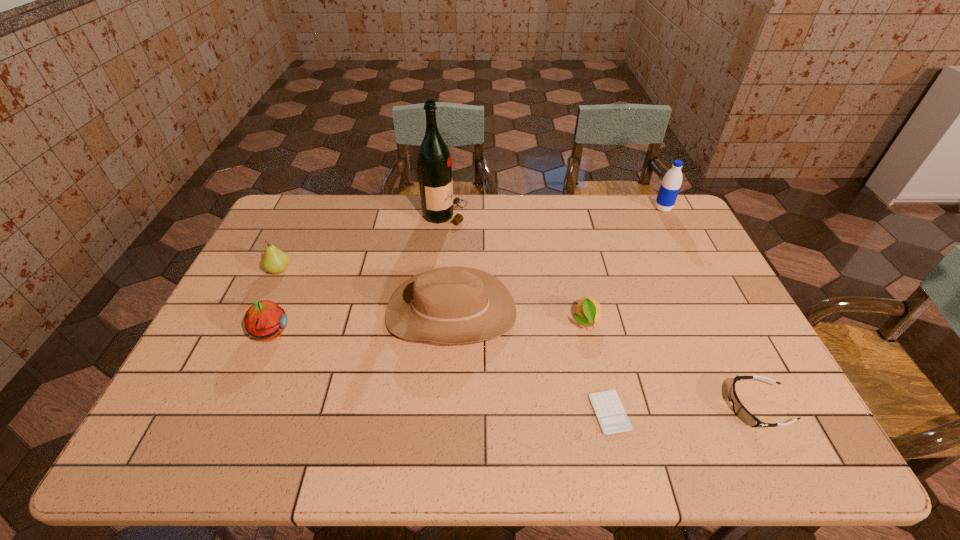
This screenshot has width=960, height=540. Identify the location of free space between the cowboy hat and the water bottle. (557, 260).

Identify which object is the sixth closest to the cowboy hat. Please provide its 2D coordinates. Your answer should be formatted as a tuple, i.e. [(x, y)], where the tuple contains the x and y coordinates of a point satisfying the conditions above.

[(742, 413)]

Point out which object is positioned as the sixth nearest to the third shortest object. Please provide its 2D coordinates. Your answer should be formatted as a tuple, i.e. [(x, y)], where the tuple contains the x and y coordinates of a point satisfying the conditions above.

[(265, 320)]

I want to click on vacant area that satisfies the following two spatial constraints: 1. on the surface of the wine bottle; 2. on the back side of the cowboy hat, so click(436, 312).

The width and height of the screenshot is (960, 540). Find the location of `blank space that satisfies the following two spatial constraints: 1. on the front side of the water bottle; 2. on the front and sides of the second shortest object`. blank space that satisfies the following two spatial constraints: 1. on the front side of the water bottle; 2. on the front and sides of the second shortest object is located at coordinates (764, 407).

Locate an element on the screen. vacant space that satisfies the following two spatial constraints: 1. on the front side of the second tallest object; 2. on the surface of the wine bottle is located at coordinates pos(666,214).